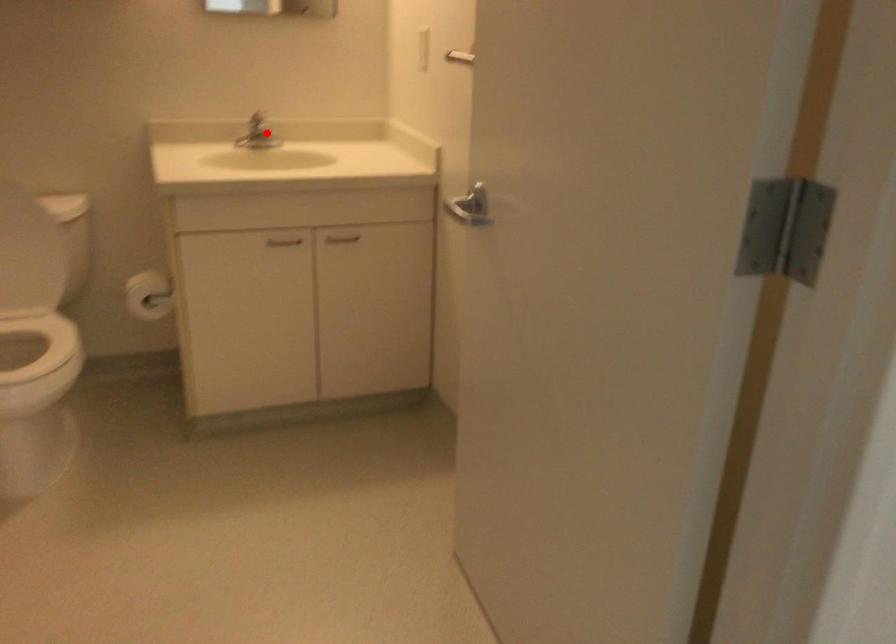
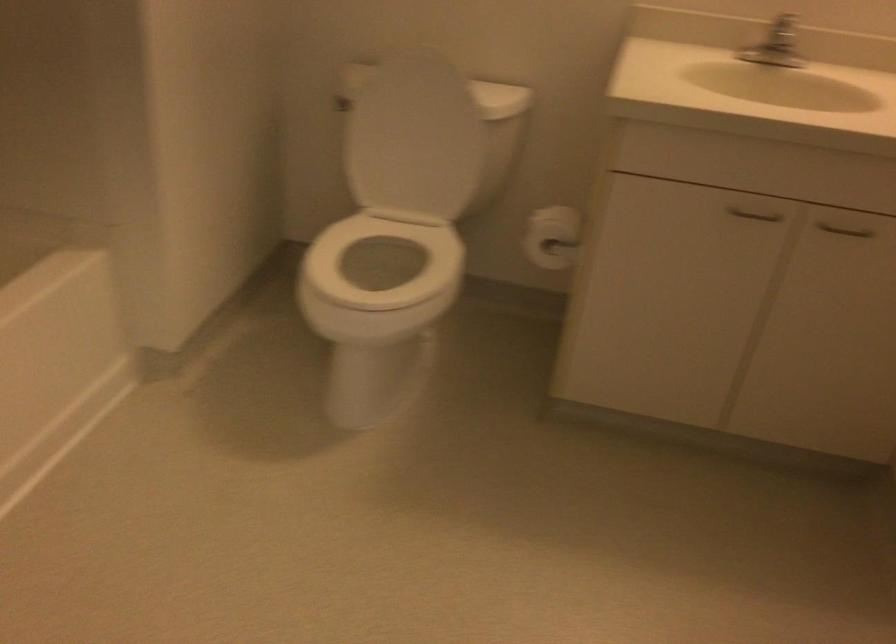
Where in the second image is the point corresponding to the highlighted location from the first image?

(778, 55)